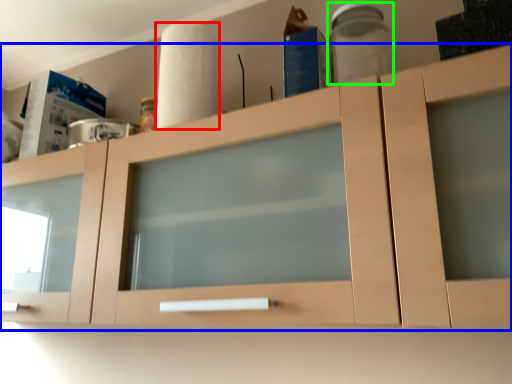
Question: Estimate the real-world distances between objects in this image. Which object is farther from paper towel (highlighted by a red box), cabinetry (highlighted by a blue box) or glass jar (highlighted by a green box)?

Choices:
 (A) cabinetry
 (B) glass jar

Answer: (B)